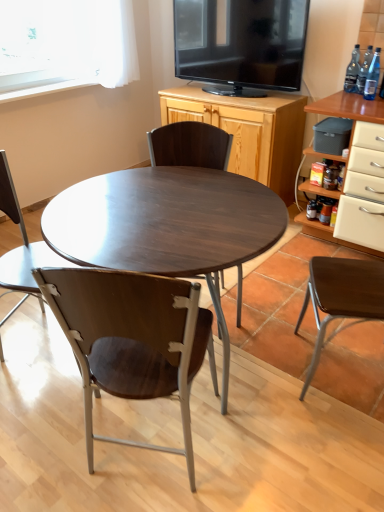
Identify the location of vacant region in front of wooden chair at lower left, the first chair positioned from the left. The image size is (384, 512). (35, 411).